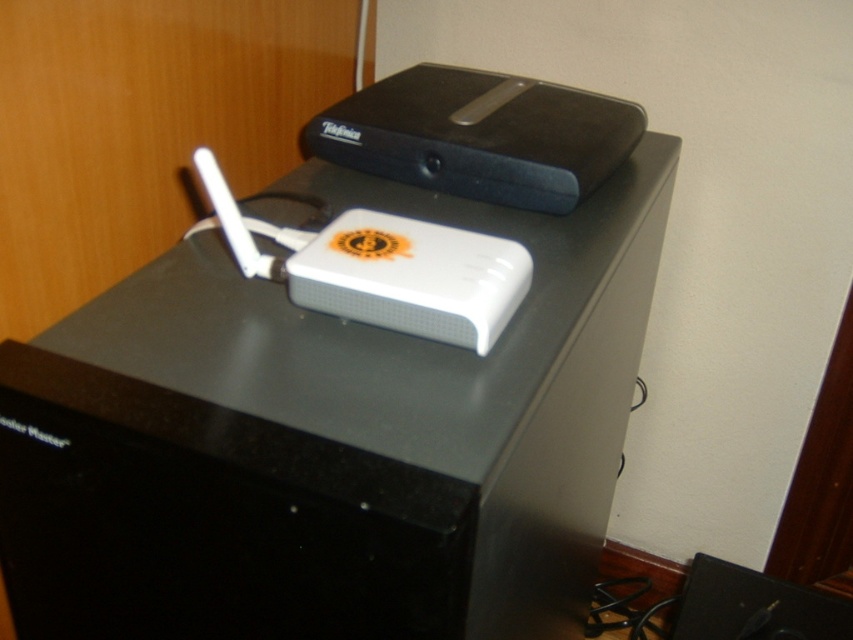
Is white plastic router at center bigger than black plastic speaker at lower right?

Yes.

Is white plastic router at center smaller than black plastic speaker at lower right?

Actually, white plastic router at center might be larger than black plastic speaker at lower right.

Does point (225, 552) come in front of point (701, 564)?

Yes, point (225, 552) is in front of point (701, 564).

Locate an element on the screen. The height and width of the screenshot is (640, 853). white plastic router at center is located at coordinates (329, 438).